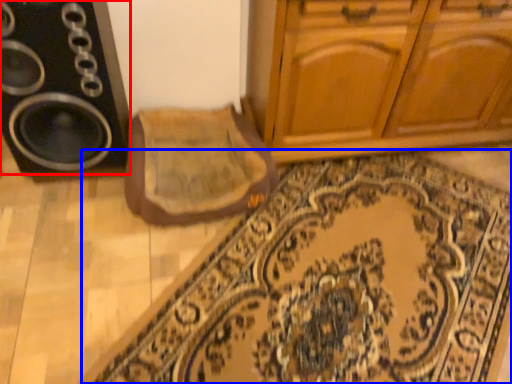
Question: Which object appears farthest to the camera in this image, speaker (highlighted by a red box) or doormat (highlighted by a blue box)?

Choices:
 (A) speaker
 (B) doormat

Answer: (A)